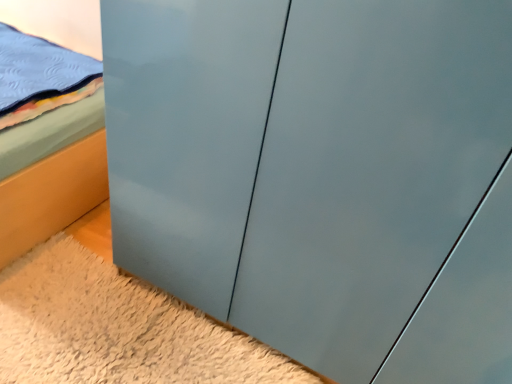
Question: Is matte gray cabinet at lower center wider or thinner than matte blue bed at left?

Choices:
 (A) wide
 (B) thin

Answer: (A)

Question: Considering the positions of matte gray cabinet at lower center and matte blue bed at left in the image, is matte gray cabinet at lower center bigger or smaller than matte blue bed at left?

Choices:
 (A) big
 (B) small

Answer: (B)

Question: Is matte gray cabinet at lower center situated inside matte blue bed at left or outside?

Choices:
 (A) outside
 (B) inside

Answer: (A)

Question: Is matte blue bed at left wider or thinner than matte gray cabinet at lower center?

Choices:
 (A) wide
 (B) thin

Answer: (B)

Question: Is matte blue bed at left situated inside matte gray cabinet at lower center or outside?

Choices:
 (A) inside
 (B) outside

Answer: (B)

Question: Based on their positions, is matte blue bed at left located to the left or right of matte gray cabinet at lower center?

Choices:
 (A) left
 (B) right

Answer: (A)

Question: Looking at the image, does matte blue bed at left seem bigger or smaller compared to matte gray cabinet at lower center?

Choices:
 (A) small
 (B) big

Answer: (B)